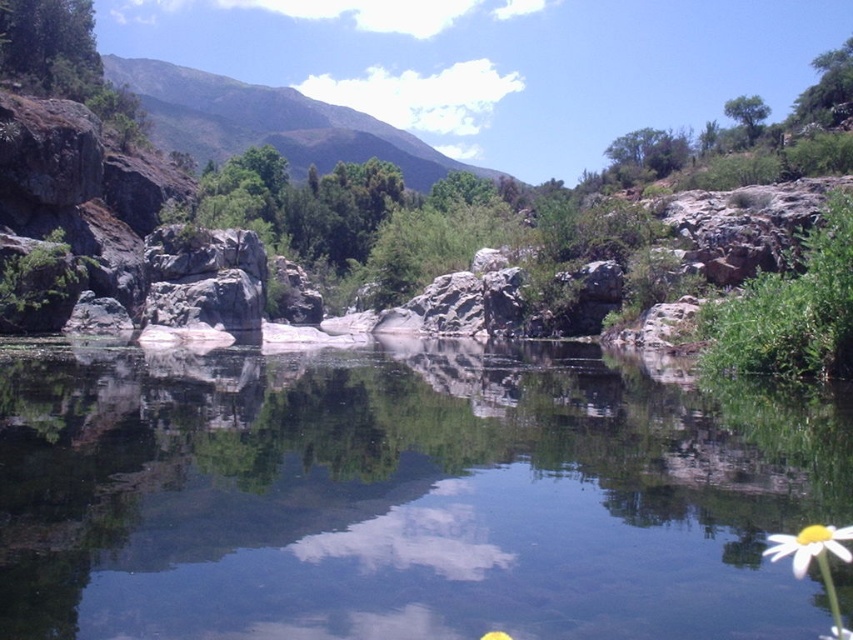
You are a hiker who wants to place a 100 feet long tent between the gray rock at center and the white matte flower at lower right. Is there enough space for the tent?

The gray rock at center is 203.82 feet from the white matte flower at lower right, so yes, the tent can be placed between them as the distance is sufficient.

You are standing at the point with coordinates point [798,554] and want to see the point with coordinates point [209,276]. Can you see it directly without any obstructions?

Point [209,276] is behind point [798,554], so you cannot see it directly without any obstructions.

You are standing at the edge of the river and want to place a small statue between the green grassy mountain at upper center and the white matte flower at lower right. Which side should you place it closer to so that it fits better with the scene?

The green grassy mountain at upper center is wider than the white matte flower at lower right, so placing the statue closer to the green grassy mountain at upper center would allow it to fit better with the scene.